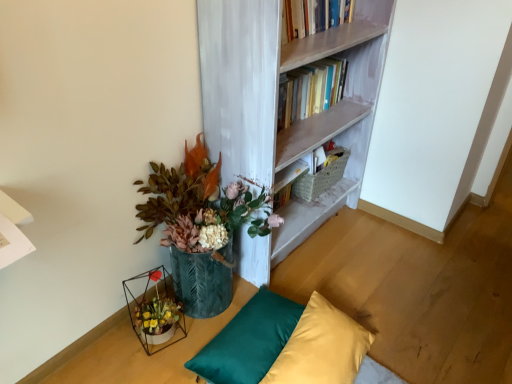
The height and width of the screenshot is (384, 512). I want to click on metallic green vase at lower left, so click(x=200, y=226).

How much space does teal satin pillow at lower center, placed as the second pillow when sorted from right to left, occupy horizontally?

12.15 inches.

The height and width of the screenshot is (384, 512). What do you see at coordinates (248, 341) in the screenshot? I see `teal satin pillow at lower center, the 1th pillow in the left-to-right sequence` at bounding box center [248, 341].

Describe the element at coordinates (135, 350) in the screenshot. I see `metallic wire table at lower left` at that location.

You are a GUI agent. You are given a task and a screenshot of the screen. Output one action in this format:
    pyautogui.click(x=<x>, y=<y>)
    Task: Click on the metallic green vase at lower left
    This screenshot has width=512, height=384.
    Given the screenshot: What is the action you would take?
    pyautogui.click(x=200, y=226)

Does metallic green vase at lower left have a greater height compared to silky yellow pillow at lower center, placed as the 2th pillow when sorted from left to right?

Result: Yes.

Can you confirm if metallic green vase at lower left is wider than silky yellow pillow at lower center, which appears as the 1th pillow when viewed from the right?

Yes.

Is there a large distance between metallic green vase at lower left and silky yellow pillow at lower center, which appears as the 1th pillow when viewed from the right?

Actually, metallic green vase at lower left and silky yellow pillow at lower center, which appears as the 1th pillow when viewed from the right, are a little close together.

Is metallic green vase at lower left bigger than silky yellow pillow at lower center, which appears as the 1th pillow when viewed from the right?

Correct, metallic green vase at lower left is larger in size than silky yellow pillow at lower center, which appears as the 1th pillow when viewed from the right.

Considering the sizes of objects silky yellow pillow at lower center, placed as the 2th pillow when sorted from left to right, and metallic wire table at lower left in the image provided, who is wider, silky yellow pillow at lower center, placed as the 2th pillow when sorted from left to right, or metallic wire table at lower left?

Wider between the two is silky yellow pillow at lower center, placed as the 2th pillow when sorted from left to right.

Is silky yellow pillow at lower center, which appears as the 1th pillow when viewed from the right, oriented away from metallic wire table at lower left?

Yes, silky yellow pillow at lower center, which appears as the 1th pillow when viewed from the right, is facing away from metallic wire table at lower left.

From a real-world perspective, which pillow is the 2nd one above the metallic wire table at lower left? Please provide its 2D coordinates.

[(321, 348)]

Between teal satin pillow at lower center, the 1th pillow in the left-to-right sequence, and white painted wood bookcase at upper center, which one has smaller size?

With smaller size is teal satin pillow at lower center, the 1th pillow in the left-to-right sequence.

From a real-world perspective, which is physically above, teal satin pillow at lower center, the 1th pillow in the left-to-right sequence, or white painted wood bookcase at upper center?

In real-world perspective, white painted wood bookcase at upper center is above.

Is teal satin pillow at lower center, placed as the second pillow when sorted from right to left, at the left side of white painted wood bookcase at upper center?

Yes, teal satin pillow at lower center, placed as the second pillow when sorted from right to left, is to the left of white painted wood bookcase at upper center.

Is teal satin pillow at lower center, the 1th pillow in the left-to-right sequence, not close to white painted wood bookcase at upper center?

No.

Is point (345, 322) behind point (269, 339)?

Yes, it is.

Is the position of silky yellow pillow at lower center, placed as the 2th pillow when sorted from left to right, less distant than that of teal satin pillow at lower center, placed as the second pillow when sorted from right to left?

Yes, silky yellow pillow at lower center, placed as the 2th pillow when sorted from left to right, is closer to the viewer.

Which object is thinner, silky yellow pillow at lower center, placed as the 2th pillow when sorted from left to right, or teal satin pillow at lower center, placed as the second pillow when sorted from right to left?

Thinner between the two is teal satin pillow at lower center, placed as the second pillow when sorted from right to left.

From the image's perspective, which is above, silky yellow pillow at lower center, which appears as the 1th pillow when viewed from the right, or teal satin pillow at lower center, placed as the second pillow when sorted from right to left?

teal satin pillow at lower center, placed as the second pillow when sorted from right to left, from the image's perspective.

Looking at this image, is metallic wire table at lower left thinner than silky yellow pillow at lower center, which appears as the 1th pillow when viewed from the right?

Correct, the width of metallic wire table at lower left is less than that of silky yellow pillow at lower center, which appears as the 1th pillow when viewed from the right.

Considering the sizes of objects metallic wire table at lower left and silky yellow pillow at lower center, placed as the 2th pillow when sorted from left to right, in the image provided, who is smaller, metallic wire table at lower left or silky yellow pillow at lower center, placed as the 2th pillow when sorted from left to right,?

Smaller between the two is metallic wire table at lower left.

Locate an element on the screen. Image resolution: width=512 pixels, height=384 pixels. table directly beneath the silky yellow pillow at lower center, which appears as the 1th pillow when viewed from the right (from a real-world perspective) is located at coordinates (135, 350).

From a real-world perspective, which object rests below the other?

metallic wire table at lower left, from a real-world perspective.

Is woven beige basket at upper center facing away from white painted wood bookcase at upper center?

Yes.

Between woven beige basket at upper center and white painted wood bookcase at upper center, which one has more height?

white painted wood bookcase at upper center.

Is white painted wood bookcase at upper center located within woven beige basket at upper center?

No, white painted wood bookcase at upper center is not a part of woven beige basket at upper center.

Are woven beige basket at upper center and white painted wood bookcase at upper center beside each other?

There is a gap between woven beige basket at upper center and white painted wood bookcase at upper center.

From a real-world perspective, who is located higher, white painted wood bookcase at upper center or woven beige basket at upper center?

white painted wood bookcase at upper center is physically above.

Is white painted wood bookcase at upper center looking in the opposite direction of woven beige basket at upper center?

That's right, white painted wood bookcase at upper center is facing away from woven beige basket at upper center.

Which object is further away from the camera taking this photo, white painted wood bookcase at upper center or woven beige basket at upper center?

Positioned behind is woven beige basket at upper center.

The width and height of the screenshot is (512, 384). Find the location of `houseplant behind the silky yellow pillow at lower center, placed as the 2th pillow when sorted from left to right`. houseplant behind the silky yellow pillow at lower center, placed as the 2th pillow when sorted from left to right is located at coordinates (200, 226).

From a real-world perspective, starting from the metallic wire table at lower left, which pillow is the 2nd one vertically above it? Please provide its 2D coordinates.

[(321, 348)]

Looking at the image, which one is located further to woven beige basket at upper center, white painted wood bookcase at upper center or teal satin pillow at lower center, the 1th pillow in the left-to-right sequence?

Based on the image, teal satin pillow at lower center, the 1th pillow in the left-to-right sequence, appears to be further to woven beige basket at upper center.

When comparing their distances from metallic wire table at lower left, does woven beige basket at upper center or white painted wood bookcase at upper center seem further?

The object further to metallic wire table at lower left is woven beige basket at upper center.

From the image, which object appears to be nearer to teal satin pillow at lower center, placed as the second pillow when sorted from right to left, woven beige basket at upper center or metallic wire table at lower left?

metallic wire table at lower left lies closer to teal satin pillow at lower center, placed as the second pillow when sorted from right to left, than the other object.

Estimate the real-world distances between objects in this image. Which object is further from woven beige basket at upper center, silky yellow pillow at lower center, placed as the 2th pillow when sorted from left to right, or metallic wire table at lower left?

metallic wire table at lower left.

Considering their positions, is white painted wood bookcase at upper center positioned further to silky yellow pillow at lower center, which appears as the 1th pillow when viewed from the right, than metallic wire table at lower left?

white painted wood bookcase at upper center is positioned further to the anchor silky yellow pillow at lower center, which appears as the 1th pillow when viewed from the right.

Estimate the real-world distances between objects in this image. Which object is further from woven beige basket at upper center, metallic green vase at lower left or teal satin pillow at lower center, the 1th pillow in the left-to-right sequence?

teal satin pillow at lower center, the 1th pillow in the left-to-right sequence, lies further to woven beige basket at upper center than the other object.

Considering their positions, is white painted wood bookcase at upper center positioned closer to metallic green vase at lower left than woven beige basket at upper center?

Among the two, white painted wood bookcase at upper center is located nearer to metallic green vase at lower left.

Looking at this image, which object lies further to the anchor point metallic wire table at lower left, teal satin pillow at lower center, placed as the second pillow when sorted from right to left, or woven beige basket at upper center?

The object further to metallic wire table at lower left is woven beige basket at upper center.

At what (x,y) coordinates should I click in order to perform the action: click on bookcase between silky yellow pillow at lower center, placed as the 2th pillow when sorted from left to right, and woven beige basket at upper center, along the z-axis. Please return your answer as a coordinate pair (x, y). The width and height of the screenshot is (512, 384). Looking at the image, I should click on (277, 110).

In order to click on pillow between white painted wood bookcase at upper center and silky yellow pillow at lower center, placed as the 2th pillow when sorted from left to right, from top to bottom in this screenshot , I will do `click(248, 341)`.

Where is `houseplant between metallic wire table at lower left and woven beige basket at upper center in the horizontal direction`? This screenshot has height=384, width=512. houseplant between metallic wire table at lower left and woven beige basket at upper center in the horizontal direction is located at coordinates (200, 226).

At what (x,y) coordinates should I click in order to perform the action: click on pillow between metallic wire table at lower left and silky yellow pillow at lower center, which appears as the 1th pillow when viewed from the right, from left to right. Please return your answer as a coordinate pair (x, y). This screenshot has width=512, height=384. Looking at the image, I should click on (248, 341).